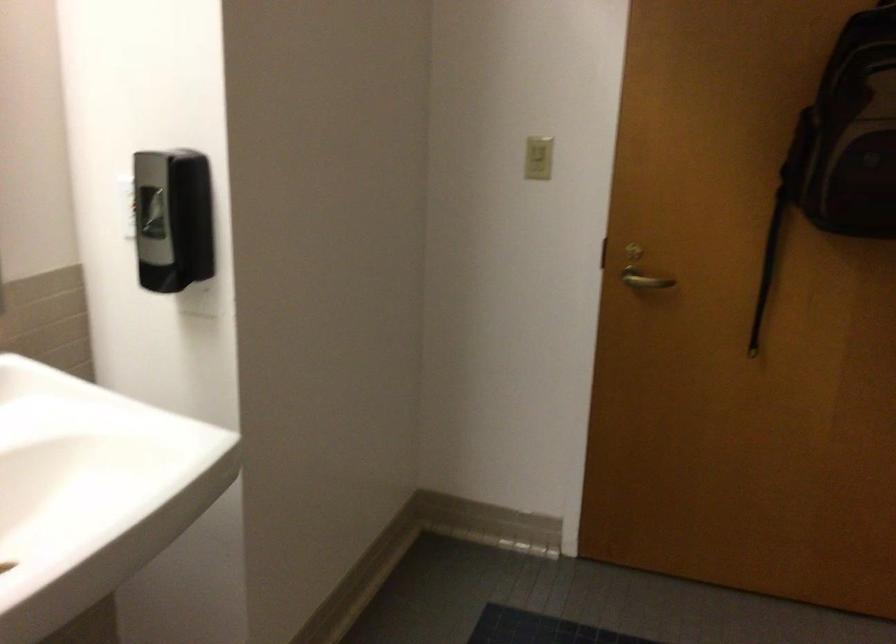
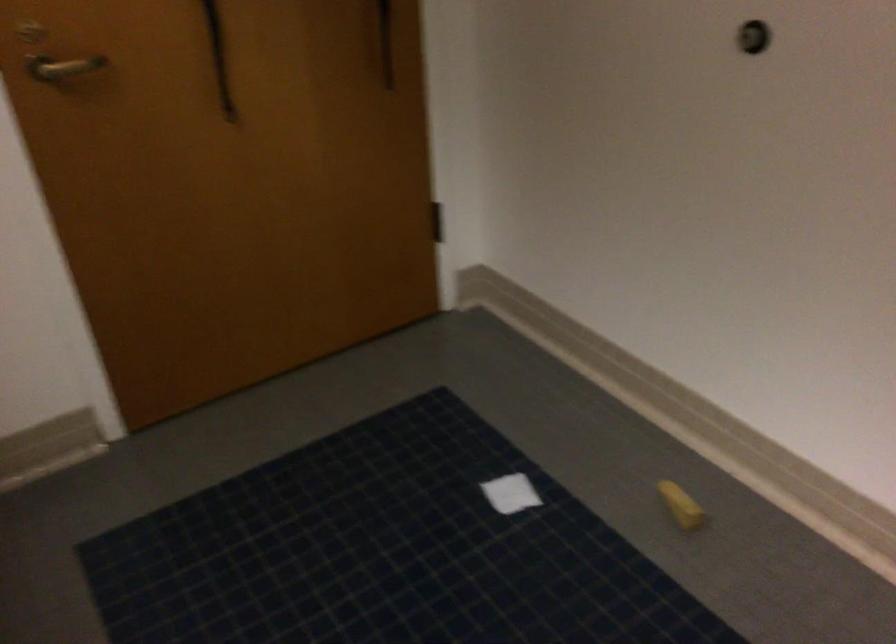
In the second image, find the point that corresponds to point (627, 281) in the first image.

(62, 67)